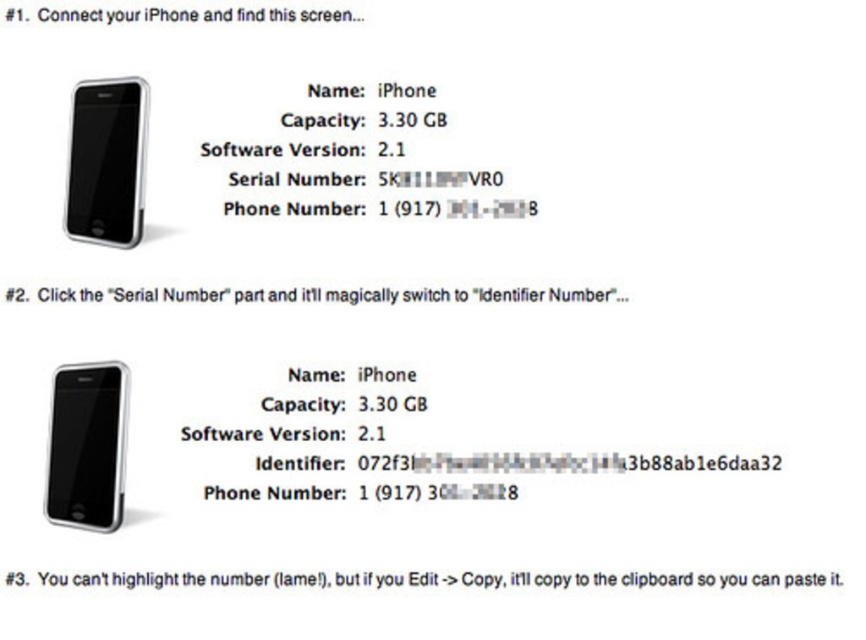
Question: Does matte black smartphone at center have a smaller size compared to silver metallic smartphone at upper left?

Choices:
 (A) yes
 (B) no

Answer: (B)

Question: From the image, what is the correct spatial relationship of matte black smartphone at center in relation to silver metallic smartphone at upper left?

Choices:
 (A) above
 (B) below

Answer: (B)

Question: Is matte black smartphone at center in front of black text at center?

Choices:
 (A) yes
 (B) no

Answer: (A)

Question: Which of the following is the closest to the observer?

Choices:
 (A) white text on transparent background at center
 (B) black text at center

Answer: (A)

Question: Which object is the closest to the matte black smartphone at center?

Choices:
 (A) white glossy text at upper center
 (B) white text on transparent background at center

Answer: (B)

Question: Which of the following is the closest to the observer?

Choices:
 (A) white glossy text at upper center
 (B) matte black smartphone at center
 (C) black text at center

Answer: (B)